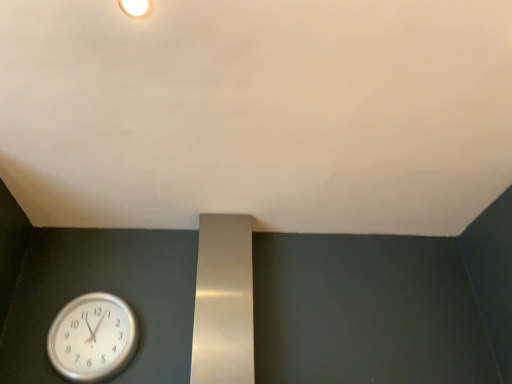
What do you see at coordinates (136, 7) in the screenshot?
I see `white matte light fixture at upper center` at bounding box center [136, 7].

Locate an element on the screen. The width and height of the screenshot is (512, 384). white matte light fixture at upper center is located at coordinates (136, 7).

What do you see at coordinates (257, 113) in the screenshot? I see `white matte wall at upper center` at bounding box center [257, 113].

What are the coordinates of `white matte wall at upper center` in the screenshot? It's located at (257, 113).

The width and height of the screenshot is (512, 384). What are the coordinates of `white matte light fixture at upper center` in the screenshot? It's located at (136, 7).

How much distance is there between white matte light fixture at upper center and white matte wall at upper center?

white matte light fixture at upper center and white matte wall at upper center are 26.30 inches apart.

There is a white matte light fixture at upper center. Where is `backdrop above it (from a real-world perspective)`? Image resolution: width=512 pixels, height=384 pixels. backdrop above it (from a real-world perspective) is located at coordinates (257, 113).

Can white matte wall at upper center be found inside white matte light fixture at upper center?

No, white matte wall at upper center is not surrounded by white matte light fixture at upper center.

In terms of height, does white matte light fixture at upper center look taller or shorter compared to white matte wall at upper center?

In the image, white matte light fixture at upper center appears to be shorter than white matte wall at upper center.

From the image's perspective, is white matte wall at upper center positioned above or below silver metallic clock at lower left?

Based on their image positions, white matte wall at upper center is located above silver metallic clock at lower left.

Is white matte wall at upper center taller or shorter than silver metallic clock at lower left?

In the image, white matte wall at upper center appears to be shorter than silver metallic clock at lower left.

Is white matte wall at upper center located outside silver metallic clock at lower left?

white matte wall at upper center is positioned outside silver metallic clock at lower left.

How many degrees apart are the facing directions of white matte wall at upper center and silver metallic clock at lower left?

white matte wall at upper center and silver metallic clock at lower left are facing 180 degrees away from each other.

Looking at this image, based on their positions, is silver metallic clock at lower left located to the left or right of white matte wall at upper center?

In the image, silver metallic clock at lower left appears on the left side of white matte wall at upper center.

Considering the sizes of objects silver metallic clock at lower left and white matte wall at upper center in the image provided, who is thinner, silver metallic clock at lower left or white matte wall at upper center?

Thinner between the two is silver metallic clock at lower left.

Is point (99, 320) closer to viewer compared to point (170, 37)?

No, (99, 320) is further to viewer.

Is silver metallic clock at lower left placed right next to white matte wall at upper center?

No, silver metallic clock at lower left is not next to white matte wall at upper center.

From a real-world perspective, is white matte light fixture at upper center located beneath silver metallic clock at lower left?

Incorrect, from a real-world perspective, white matte light fixture at upper center is higher than silver metallic clock at lower left.

Which object is further away from the camera taking this photo, white matte light fixture at upper center or silver metallic clock at lower left?

silver metallic clock at lower left is more distant.

Which is correct: white matte light fixture at upper center is inside silver metallic clock at lower left, or outside of it?

white matte light fixture at upper center lies outside silver metallic clock at lower left.

Considering the sizes of objects white matte light fixture at upper center and silver metallic clock at lower left in the image provided, who is thinner, white matte light fixture at upper center or silver metallic clock at lower left?

Thinner between the two is white matte light fixture at upper center.

Considering the relative sizes of silver metallic clock at lower left and white matte light fixture at upper center in the image provided, is silver metallic clock at lower left shorter than white matte light fixture at upper center?

Incorrect, the height of silver metallic clock at lower left does not fall short of that of white matte light fixture at upper center.

Does silver metallic clock at lower left have a smaller size compared to white matte light fixture at upper center?

Actually, silver metallic clock at lower left might be larger than white matte light fixture at upper center.

Is silver metallic clock at lower left surrounding white matte light fixture at upper center?

That's incorrect, white matte light fixture at upper center is not inside silver metallic clock at lower left.

Measure the distance between silver metallic clock at lower left and white matte light fixture at upper center.

silver metallic clock at lower left is 1.24 meters away from white matte light fixture at upper center.

How far apart are white matte wall at upper center and white matte light fixture at upper center?

white matte wall at upper center and white matte light fixture at upper center are 26.30 inches apart from each other.

Relative to white matte light fixture at upper center, is white matte wall at upper center in front or behind?

white matte wall at upper center is in front of white matte light fixture at upper center.

Can you confirm if white matte wall at upper center is thinner than white matte light fixture at upper center?

No, white matte wall at upper center is not thinner than white matte light fixture at upper center.

At what (x,y) coordinates should I click in order to perform the action: click on backdrop in front of the white matte light fixture at upper center. Please return your answer as a coordinate pair (x, y). Image resolution: width=512 pixels, height=384 pixels. Looking at the image, I should click on 257,113.

Where is `backdrop above the silver metallic clock at lower left (from the image's perspective)`? The height and width of the screenshot is (384, 512). backdrop above the silver metallic clock at lower left (from the image's perspective) is located at coordinates coord(257,113).

From the image, which object appears to be nearer to silver metallic clock at lower left, white matte light fixture at upper center or white matte wall at upper center?

white matte wall at upper center lies closer to silver metallic clock at lower left than the other object.

Looking at the image, which one is located closer to white matte light fixture at upper center, white matte wall at upper center or silver metallic clock at lower left?

white matte wall at upper center.

Which object lies nearer to the anchor point silver metallic clock at lower left, white matte wall at upper center or white matte light fixture at upper center?

white matte wall at upper center is closer to silver metallic clock at lower left.

From the image, which object appears to be nearer to white matte wall at upper center, white matte light fixture at upper center or silver metallic clock at lower left?

The object closer to white matte wall at upper center is white matte light fixture at upper center.

Looking at the image, which one is located closer to white matte wall at upper center, silver metallic clock at lower left or white matte light fixture at upper center?

white matte light fixture at upper center lies closer to white matte wall at upper center than the other object.

Based on their spatial positions, is silver metallic clock at lower left or white matte wall at upper center closer to white matte light fixture at upper center?

white matte wall at upper center lies closer to white matte light fixture at upper center than the other object.

Locate an element on the screen. The image size is (512, 384). backdrop that lies between white matte light fixture at upper center and silver metallic clock at lower left from top to bottom is located at coordinates (257, 113).